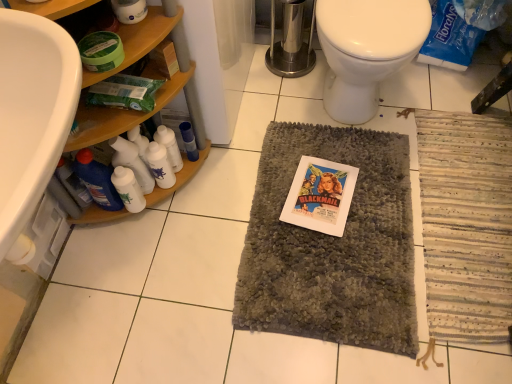
Question: Does woodenshelves at left appear on the left side of gray shaggy mat at center?

Choices:
 (A) yes
 (B) no

Answer: (A)

Question: From the image's perspective, is woodenshelves at left located beneath gray shaggy mat at center?

Choices:
 (A) yes
 (B) no

Answer: (B)

Question: From a real-world perspective, does woodenshelves at left sit lower than gray shaggy mat at center?

Choices:
 (A) no
 (B) yes

Answer: (A)

Question: Is the position of woodenshelves at left more distant than that of gray shaggy mat at center?

Choices:
 (A) yes
 (B) no

Answer: (B)

Question: Is woodenshelves at left touching gray shaggy mat at center?

Choices:
 (A) no
 (B) yes

Answer: (A)

Question: In the image, is woodenshelves at left positioned in front of or behind matte paper comic book at center?

Choices:
 (A) front
 (B) behind

Answer: (A)

Question: Based on their positions, is woodenshelves at left located to the left or right of matte paper comic book at center?

Choices:
 (A) left
 (B) right

Answer: (A)

Question: Would you say woodenshelves at left is inside or outside matte paper comic book at center?

Choices:
 (A) outside
 (B) inside

Answer: (A)

Question: Considering the positions of woodenshelves at left and matte paper comic book at center in the image, is woodenshelves at left bigger or smaller than matte paper comic book at center?

Choices:
 (A) small
 (B) big

Answer: (B)

Question: Considering their positions, is matte paper comic book at center located in front of or behind white glossy bottle at lower left, the 4th bottle viewed from the right?

Choices:
 (A) behind
 (B) front

Answer: (A)

Question: In terms of width, does matte paper comic book at center look wider or thinner when compared to white glossy bottle at lower left, the second bottle in the left-to-right sequence?

Choices:
 (A) wide
 (B) thin

Answer: (A)

Question: In terms of height, does matte paper comic book at center look taller or shorter compared to white glossy bottle at lower left, the second bottle in the left-to-right sequence?

Choices:
 (A) tall
 (B) short

Answer: (B)

Question: Is point (328, 210) closer or farther from the camera than point (121, 198)?

Choices:
 (A) farther
 (B) closer

Answer: (A)

Question: Is white plastic bottles at left, which is the 2th bottle in right-to-left order, in front of or behind blue glossy bottle at lower left, which is the 5th bottle from right to left, in the image?

Choices:
 (A) behind
 (B) front

Answer: (A)

Question: Is white plastic bottles at left, which is the 2th bottle in right-to-left order, inside or outside of blue glossy bottle at lower left, which is the 5th bottle from right to left?

Choices:
 (A) inside
 (B) outside

Answer: (B)